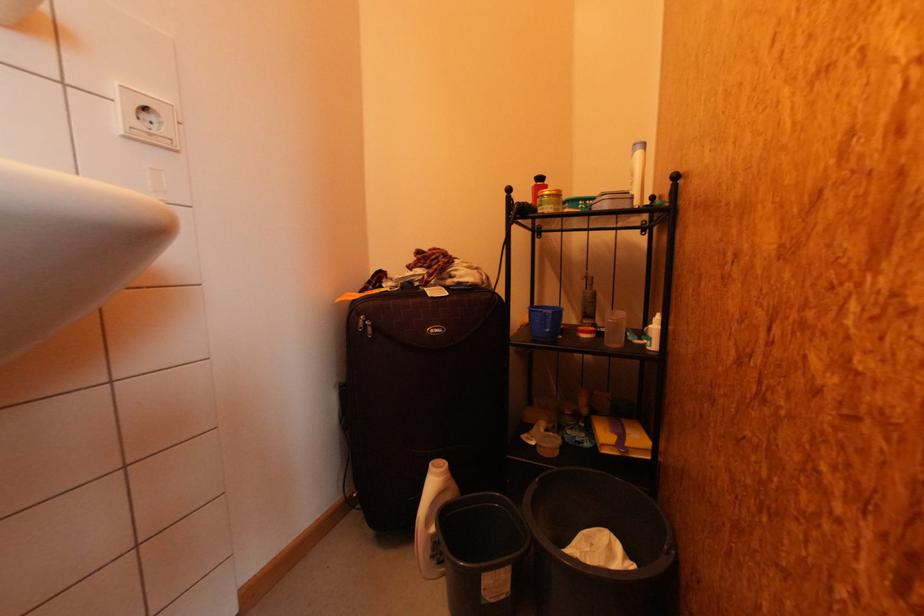
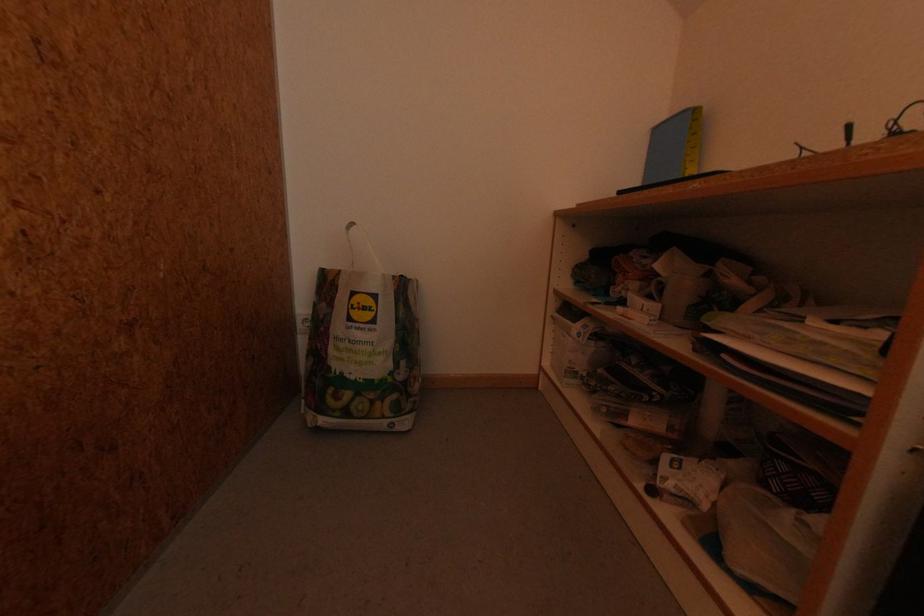
Question: The camera is either moving clockwise (left) or counter-clockwise (right) around the object. The first image is from the beginning of the video and the second image is from the end. Is the camera moving left or right when shooting the video?

Choices:
 (A) Left
 (B) Right

Answer: (A)